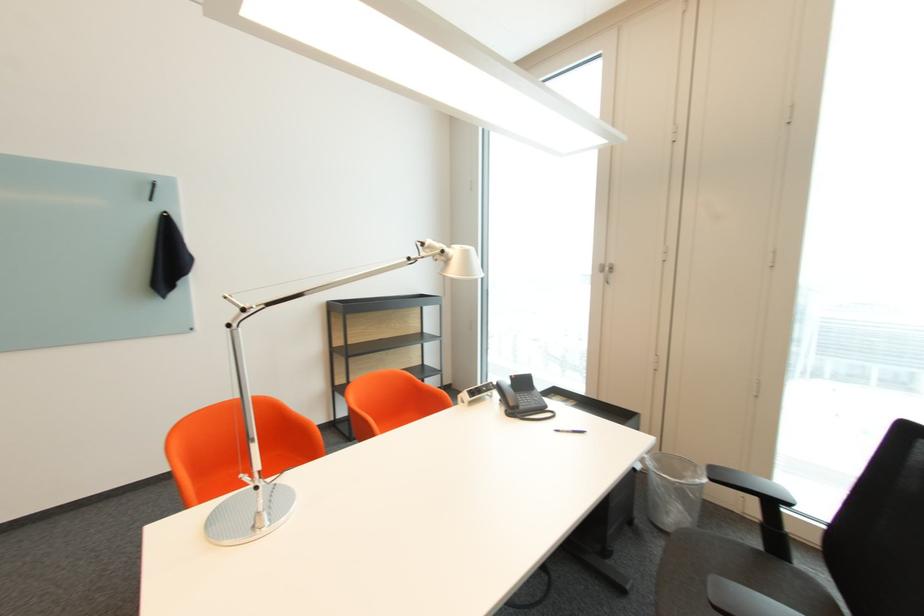
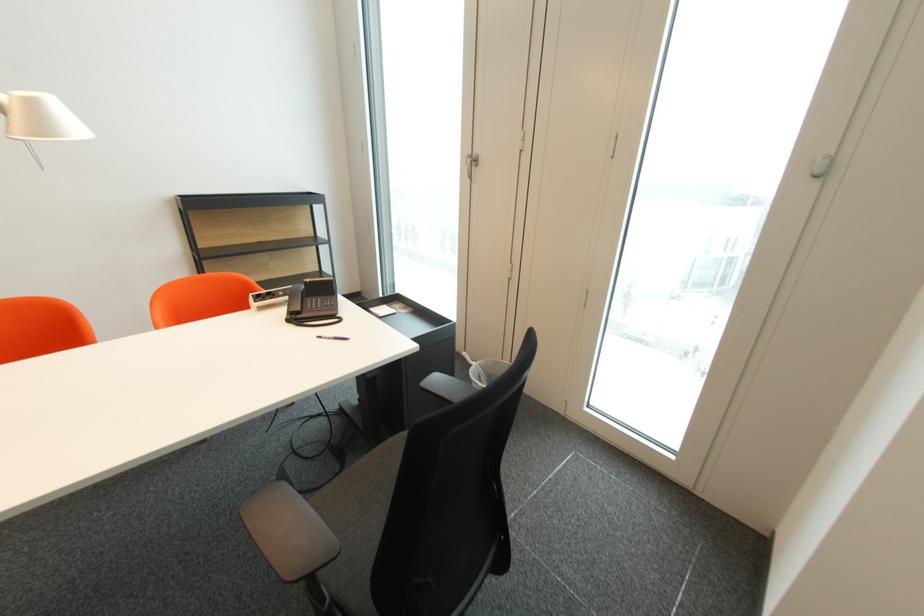
Question: The images are taken continuously from a first-person perspective. In which direction is your viewpoint rotating?

Choices:
 (A) Left
 (B) Right
 (C) Up
 (D) Down

Answer: (D)